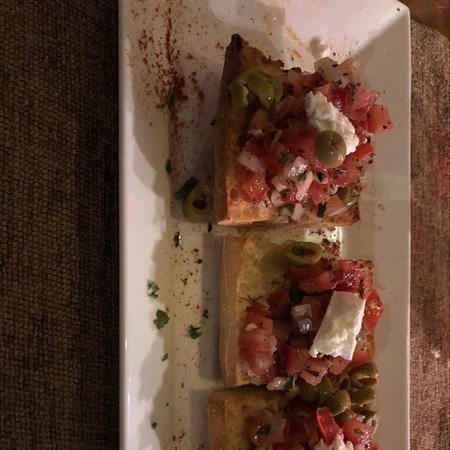
Identify the location of plate. (382, 64).